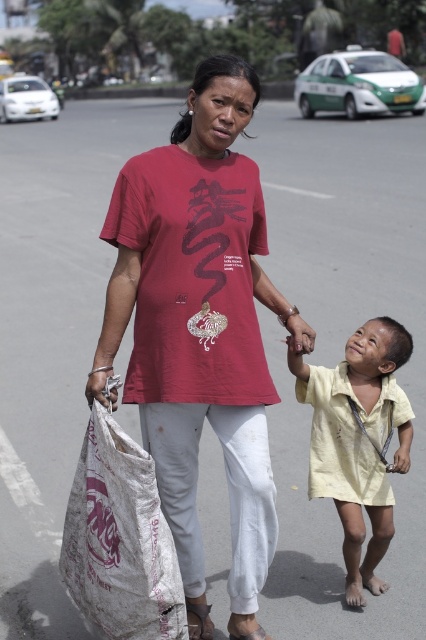
You are a photographer standing at the center of the street. You want to take a photo of both the white woven bag at lower left and the yellow cotton shirt at lower right. Which object should you focus on first to ensure both are in frame?

You should focus on the white woven bag at lower left first because it is closer to the viewer than the yellow cotton shirt at lower right, ensuring both are in frame by adjusting the camera angle accordingly.

You are a delivery person who needs to place a package on the white woven bag at lower left. The coordinates of the bag are given as point (120, 540). Can you confirm the exact location of the white woven bag at lower left?

The white woven bag at lower left is located at point (120, 540).